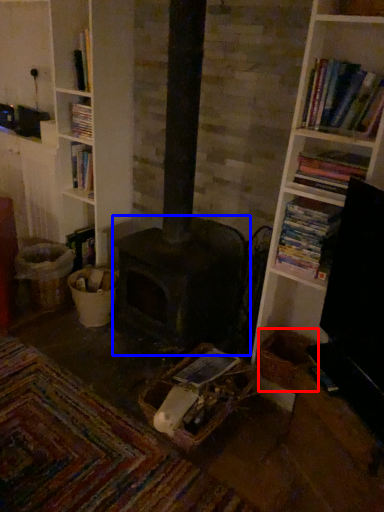
Question: Which object is closer to the camera taking this photo, basket (highlighted by a red box) or heater (highlighted by a blue box)?

Choices:
 (A) basket
 (B) heater

Answer: (A)